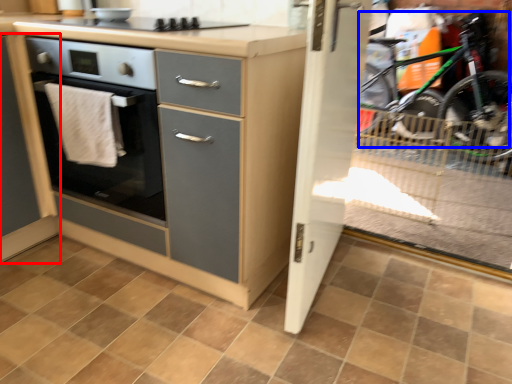
Question: Which point is closer to the camera, cabinetry (highlighted by a red box) or mountain bike (highlighted by a blue box)?

Choices:
 (A) cabinetry
 (B) mountain bike

Answer: (A)